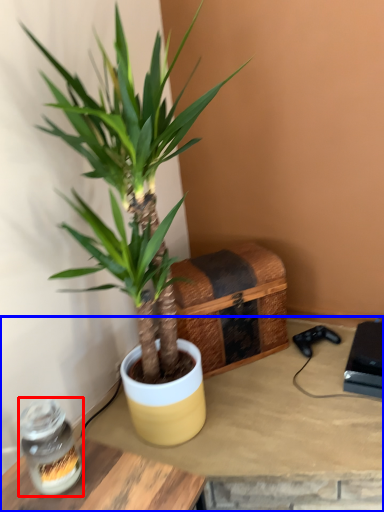
Question: Which point is closer to the camera, glass jar (highlighted by a red box) or table (highlighted by a blue box)?

Choices:
 (A) glass jar
 (B) table

Answer: (A)